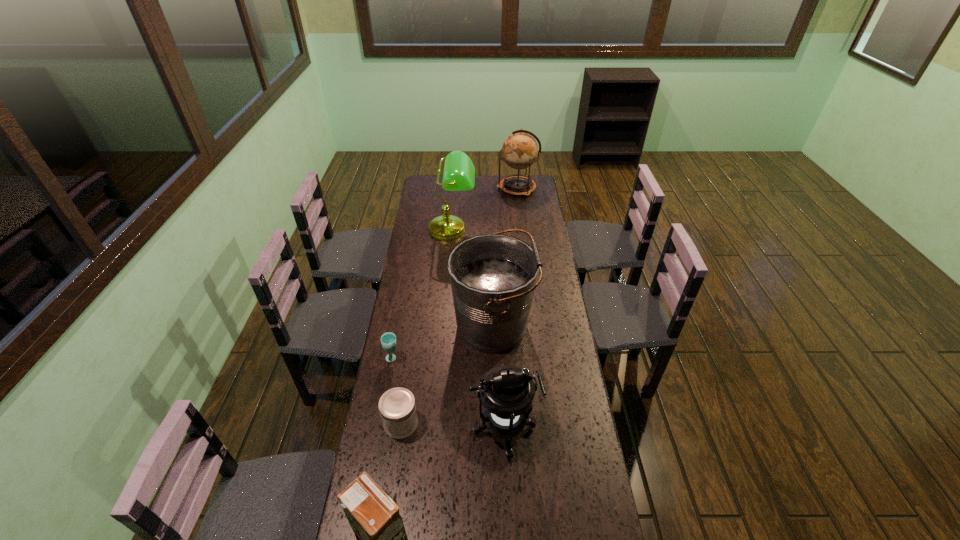
Locate an element on the screen. free space located on the back of the bucket is located at coordinates (491, 259).

Locate an element on the screen. Image resolution: width=960 pixels, height=540 pixels. vacant space located 0.160m on the back of the lantern is located at coordinates (501, 366).

Identify the location of free space located on the right of the jar. (511, 423).

Identify the location of free location located on the back of the glass. (396, 337).

The height and width of the screenshot is (540, 960). I want to click on object located at the far edge, so click(519, 150).

The width and height of the screenshot is (960, 540). Identify the location of lamp at the left edge. (459, 172).

Find the location of a particular element. jar situated at the left edge is located at coordinates (397, 407).

This screenshot has height=540, width=960. Identify the location of glass present at the left edge. (388, 340).

Locate an element on the screen. The width and height of the screenshot is (960, 540). globe present at the right edge is located at coordinates (519, 150).

Identify the location of bucket present at the right edge. Image resolution: width=960 pixels, height=540 pixels. [493, 277].